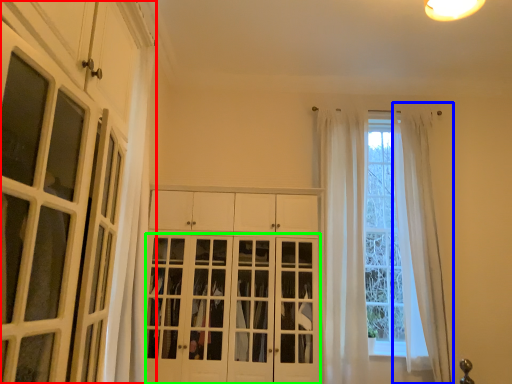
Question: Which object is the closest to the cabinetry (highlighted by a red box)? Choose among these: curtain (highlighted by a blue box) or door (highlighted by a green box).

Choices:
 (A) curtain
 (B) door

Answer: (B)